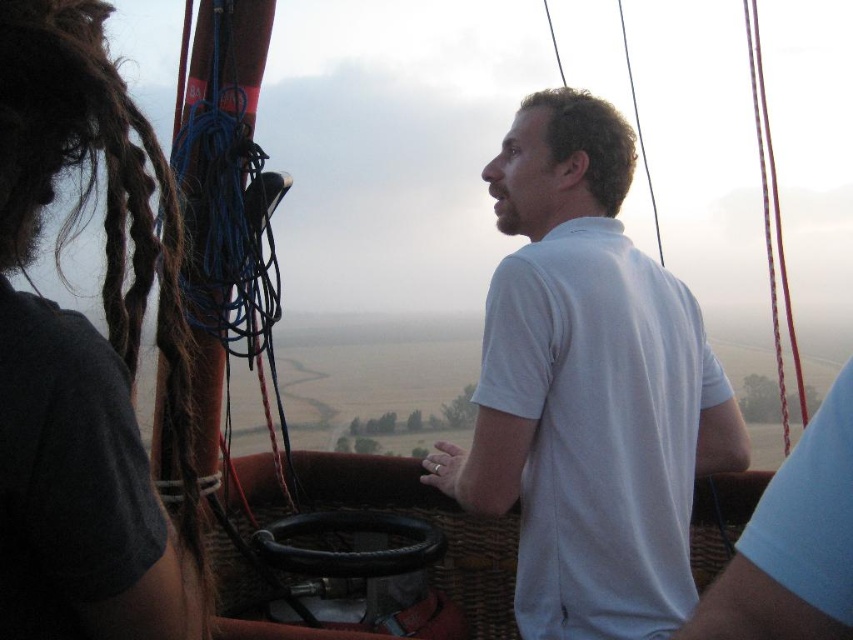
Question: Is white matte shirt at center bigger than dark brown dreadlocks at left?

Choices:
 (A) no
 (B) yes

Answer: (B)

Question: Which of the following is the closest to the observer?

Choices:
 (A) (96, 566)
 (B) (535, 99)

Answer: (A)

Question: Which point is closer to the camera?

Choices:
 (A) white matte shirt at center
 (B) dark brown dreadlocks at left

Answer: (B)

Question: Does white matte shirt at center appear on the right side of dark brown dreadlocks at left?

Choices:
 (A) yes
 (B) no

Answer: (A)

Question: Does white matte shirt at center appear on the right side of dark brown dreadlocks at left?

Choices:
 (A) yes
 (B) no

Answer: (A)